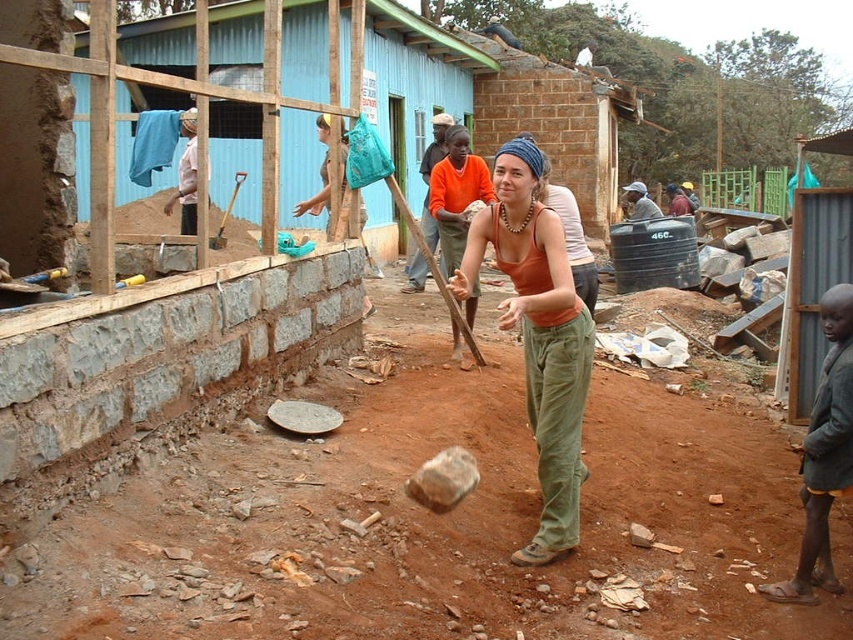
Question: Is orange shirt at center bigger than dark brown wooden stick at center?

Choices:
 (A) no
 (B) yes

Answer: (A)

Question: From the image, what is the correct spatial relationship of light brown fabric at upper left in relation to dark brown wooden stick at center?

Choices:
 (A) below
 (B) above

Answer: (A)

Question: Which point is farther to the camera?

Choices:
 (A) orange shirt at center
 (B) dark brown leather shoes at lower right
 (C) light brown fabric at upper left
 (D) light blue fabric at center

Answer: (D)

Question: Does light brown fabric at upper left have a smaller size compared to light blue fabric at center?

Choices:
 (A) yes
 (B) no

Answer: (A)

Question: Which point is closer to the camera?

Choices:
 (A) wooden handle shovel at center
 (B) dark brown leather shoes at lower right
 (C) matte orange shirt at center

Answer: (B)

Question: Which object is positioned closest to the dark brown wooden stick at center?

Choices:
 (A) light brown fabric at upper left
 (B) brown dirt field at center
 (C) matte orange shirt at center
 (D) dark brown leather shoes at lower right

Answer: (C)